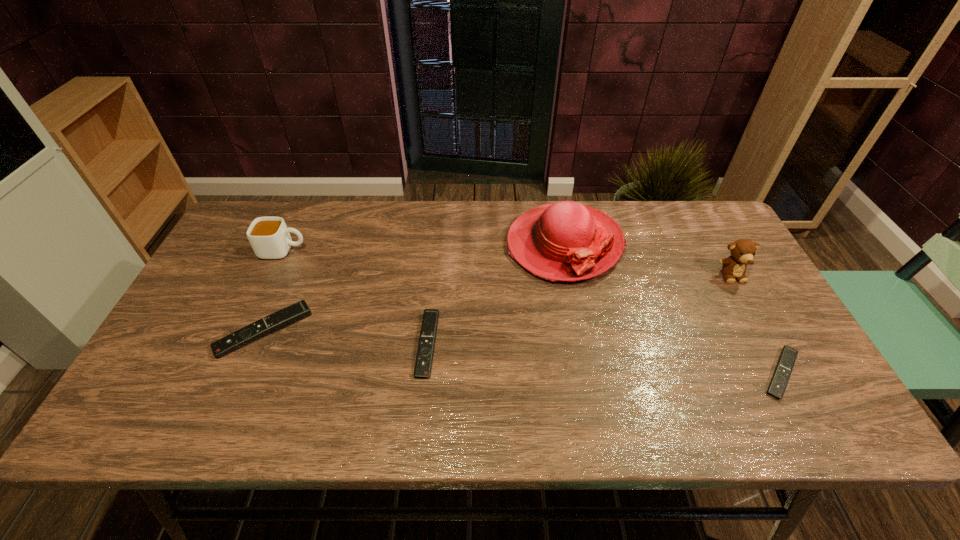
Find the location of a particular element. The image size is (960, 540). the leftmost remote control is located at coordinates (300, 310).

The width and height of the screenshot is (960, 540). I want to click on the fourth tallest object, so click(x=300, y=310).

I want to click on the fourth object from right to left, so click(x=423, y=364).

In order to click on the second tallest remote control in this screenshot , I will do `click(423, 364)`.

Where is `the shortest object`? the shortest object is located at coordinates (788, 355).

Find the location of a particular element. the rightmost remote control is located at coordinates (788, 355).

I want to click on the third object from right to left, so click(x=565, y=241).

Where is `the tallest object`? The height and width of the screenshot is (540, 960). the tallest object is located at coordinates (565, 241).

The height and width of the screenshot is (540, 960). Find the location of `cup`. cup is located at coordinates (269, 237).

The width and height of the screenshot is (960, 540). I want to click on teddy bear, so click(743, 251).